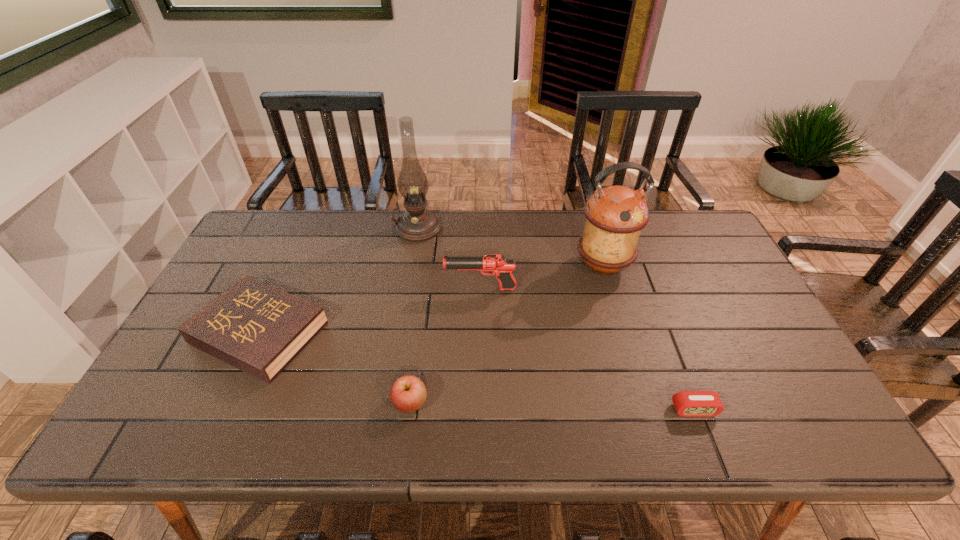
At what (x,y) coordinates should I click in order to perform the action: click on vacant area that lies between the farthest object and the nearer oil lamp. Please return your answer as a coordinate pair (x, y). The height and width of the screenshot is (540, 960). Looking at the image, I should click on (511, 247).

Locate an element on the screen. This screenshot has height=540, width=960. vacant space in between the gun and the alarm clock is located at coordinates (588, 349).

Where is `empty space that is in between the right oil lamp and the leftmost object`? This screenshot has height=540, width=960. empty space that is in between the right oil lamp and the leftmost object is located at coordinates [x=431, y=299].

The height and width of the screenshot is (540, 960). What are the coordinates of `vacant area that lies between the alarm clock and the third shortest object` in the screenshot? It's located at (552, 406).

Find the location of a particular element. The image size is (960, 540). object that ranks as the second closest to the gun is located at coordinates (417, 224).

Identify which object is the third closest to the farther oil lamp. Please provide its 2D coordinates. Your answer should be formatted as a tuple, i.e. [(x, y)], where the tuple contains the x and y coordinates of a point satisfying the conditions above.

[(615, 215)]

You are a GUI agent. You are given a task and a screenshot of the screen. Output one action in this format:
    pyautogui.click(x=<x>, y=<y>)
    Task: Click on the free spot that satisfies the following two spatial constraints: 1. on the front side of the farthest object; 2. on the left side of the apple
    This screenshot has height=540, width=960.
    Given the screenshot: What is the action you would take?
    pyautogui.click(x=389, y=403)